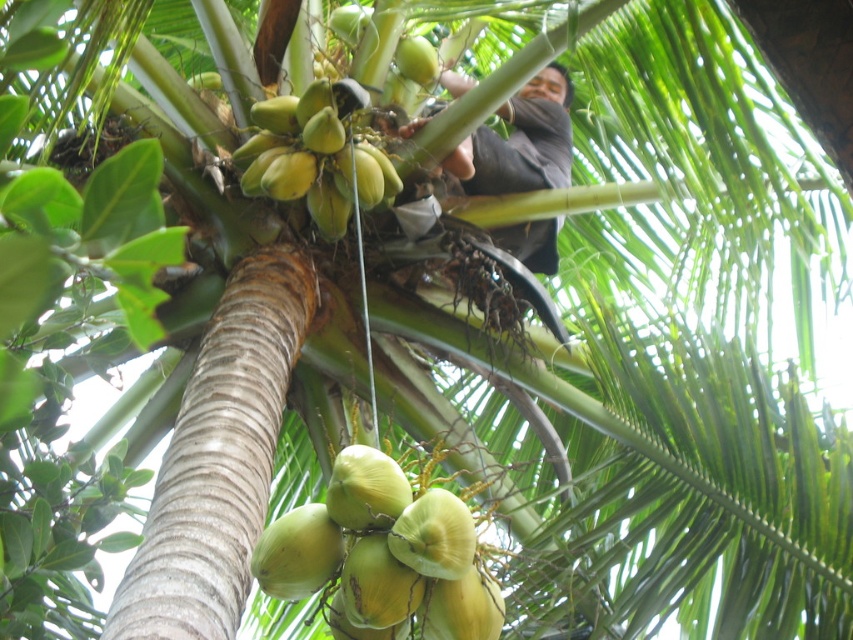
Does point (286, 188) come in front of point (553, 65)?

That is True.

Is green matte coconut at upper center behind dark brown fabric at center?

No, it is in front of dark brown fabric at center.

What do you see at coordinates (316, 156) in the screenshot? I see `green matte coconut at upper center` at bounding box center [316, 156].

At what (x,y) coordinates should I click in order to perform the action: click on green matte coconut at upper center. Please return your answer as a coordinate pair (x, y). The height and width of the screenshot is (640, 853). Looking at the image, I should click on (316, 156).

Does green matte coconut at center have a greater height compared to green matte coconut at upper center?

No.

Consider the image. Which is above, green matte coconut at center or green matte coconut at upper center?

green matte coconut at upper center is higher up.

Measure the distance between point (329, 536) and camera.

A distance of 6.29 feet exists between point (329, 536) and camera.

What are the coordinates of `green matte coconut at center` in the screenshot? It's located at (383, 556).

From the picture: Can you confirm if green matte coconut at center is wider than dark brown fabric at center?

In fact, green matte coconut at center might be narrower than dark brown fabric at center.

Which is in front, point (444, 604) or point (541, 120)?

Point (444, 604)

Locate an element on the screen. green matte coconut at center is located at coordinates (383, 556).